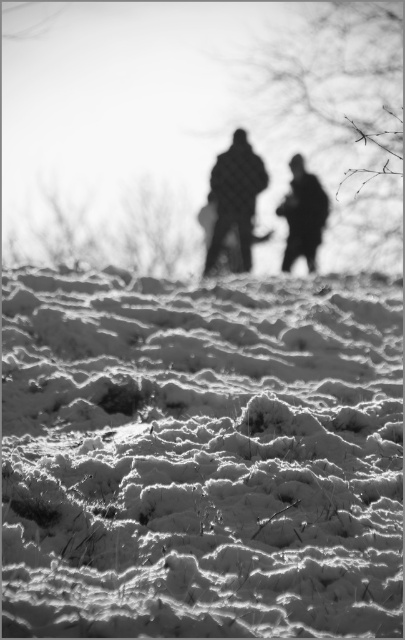
Who is more forward, (191, 570) or (304, 243)?

Point (191, 570)

Does frosted white snow at lower center have a smaller size compared to silhouette clothing at center?

Actually, frosted white snow at lower center might be larger than silhouette clothing at center.

Is point (136, 545) closer to viewer compared to point (213, 248)?

That is True.

Locate an element on the screen. frosted white snow at lower center is located at coordinates (200, 456).